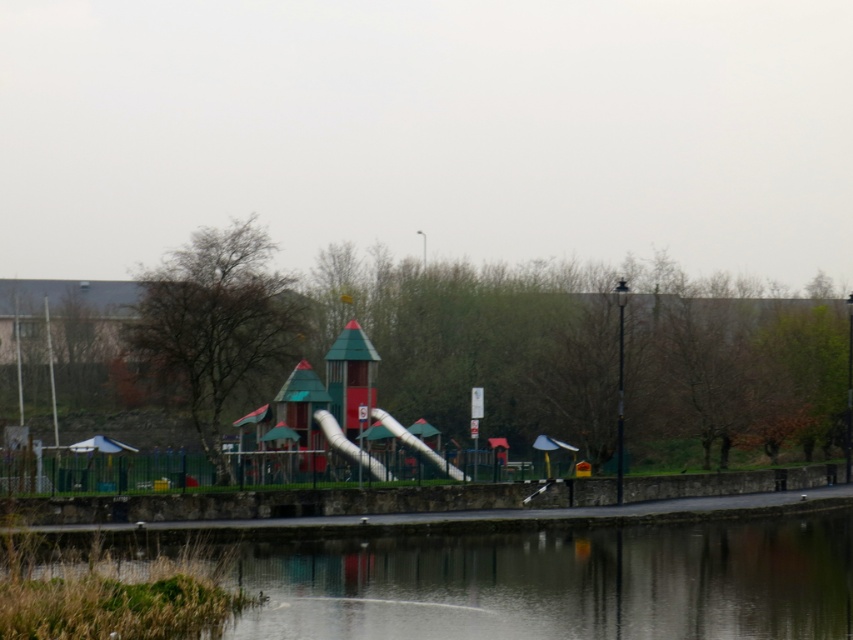
Does transparent glass water at center have a larger size compared to smooth plastic slide at center?

Yes, transparent glass water at center is bigger than smooth plastic slide at center.

Which is behind, point (718, 621) or point (397, 436)?

Positioned behind is point (397, 436).

Is point (654, 618) positioned before point (399, 428)?

Yes, it is.

This screenshot has width=853, height=640. Find the location of `transparent glass water at center`. transparent glass water at center is located at coordinates (560, 582).

Locate an element on the screen. transparent glass water at center is located at coordinates (560, 582).

Does transparent glass water at center have a larger size compared to white plastic slide at center?

Correct, transparent glass water at center is larger in size than white plastic slide at center.

Is point (657, 547) positioned behind point (317, 417)?

No, (657, 547) is in front of (317, 417).

You are a GUI agent. You are given a task and a screenshot of the screen. Output one action in this format:
    pyautogui.click(x=<x>, y=<y>)
    Task: Click on the transparent glass water at center
    This screenshot has height=640, width=853.
    Given the screenshot: What is the action you would take?
    pyautogui.click(x=560, y=582)

Who is positioned more to the left, white plastic slide at center or smooth plastic slide at center?

white plastic slide at center is more to the left.

From the picture: Does white plastic slide at center have a greater width compared to smooth plastic slide at center?

No.

What do you see at coordinates (347, 445) in the screenshot? I see `white plastic slide at center` at bounding box center [347, 445].

The width and height of the screenshot is (853, 640). In order to click on white plastic slide at center in this screenshot , I will do `click(347, 445)`.